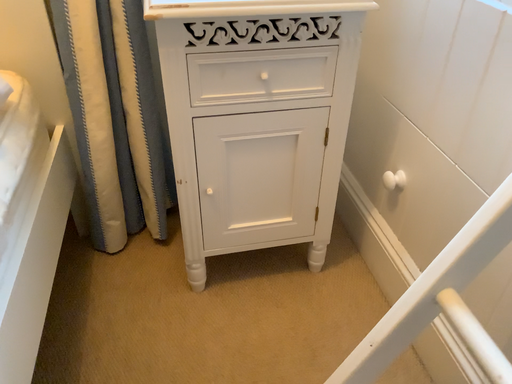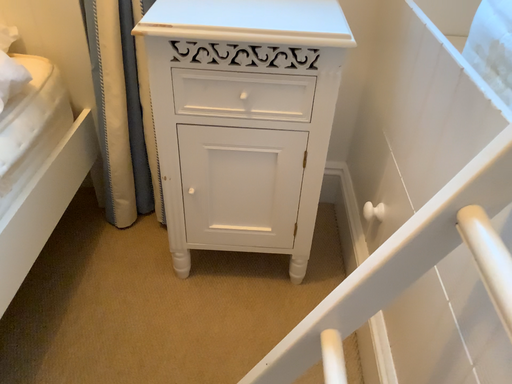
Question: Which way did the camera rotate in the video?

Choices:
 (A) rotated right
 (B) rotated left

Answer: (B)